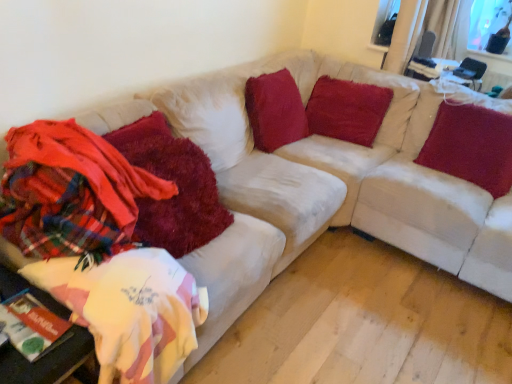
Question: Should I look upward or downward to see shaggy red blanket at left, the 2th blanket from the left?

Choices:
 (A) down
 (B) up

Answer: (A)

Question: Can you confirm if velvet red pillow at upper right, which is counted as the third pillow, starting from the left, is bigger than velvety red pillow at upper center, the second pillow in the right-to-left sequence?

Choices:
 (A) no
 (B) yes

Answer: (B)

Question: Could you tell me if velvet red pillow at upper right, which is the first pillow from right to left, is turned towards velvety red pillow at upper center, the second pillow viewed from the left?

Choices:
 (A) no
 (B) yes

Answer: (A)

Question: From the image's perspective, is velvet red pillow at upper right, which is counted as the third pillow, starting from the left, beneath velvety red pillow at upper center, the second pillow viewed from the left?

Choices:
 (A) yes
 (B) no

Answer: (A)

Question: Does velvet red pillow at upper right, which is counted as the third pillow, starting from the left, have a lesser height compared to velvety red pillow at upper center, the second pillow in the right-to-left sequence?

Choices:
 (A) yes
 (B) no

Answer: (A)

Question: Does velvet red pillow at upper right, which is the first pillow from right to left, have a greater height compared to velvety red pillow at upper center, the second pillow in the right-to-left sequence?

Choices:
 (A) no
 (B) yes

Answer: (A)

Question: From a real-world perspective, is velvet red pillow at upper right, which is counted as the third pillow, starting from the left, over velvety red pillow at upper center, the second pillow viewed from the left?

Choices:
 (A) yes
 (B) no

Answer: (A)

Question: Is velvety red pillow at upper center, the third pillow positioned from the right, further to the viewer compared to transparent glass window at upper right, the first window screen viewed from the right?

Choices:
 (A) no
 (B) yes

Answer: (A)

Question: Considering the relative sizes of velvety red pillow at upper center, the third pillow positioned from the right, and transparent glass window at upper right, the second window screen positioned from the left, in the image provided, is velvety red pillow at upper center, the third pillow positioned from the right, bigger than transparent glass window at upper right, the second window screen positioned from the left,?

Choices:
 (A) yes
 (B) no

Answer: (A)

Question: Can you confirm if velvety red pillow at upper center, arranged as the first pillow when viewed from the left, is smaller than transparent glass window at upper right, the first window screen viewed from the right?

Choices:
 (A) no
 (B) yes

Answer: (A)

Question: Is velvety red pillow at upper center, arranged as the first pillow when viewed from the left, thinner than transparent glass window at upper right, the first window screen viewed from the right?

Choices:
 (A) yes
 (B) no

Answer: (B)

Question: Considering the relative sizes of velvety red pillow at upper center, the third pillow positioned from the right, and transparent glass window at upper right, the first window screen viewed from the right, in the image provided, is velvety red pillow at upper center, the third pillow positioned from the right, shorter than transparent glass window at upper right, the first window screen viewed from the right,?

Choices:
 (A) yes
 (B) no

Answer: (B)

Question: From a real-world perspective, is velvety red pillow at upper center, the third pillow positioned from the right, positioned over transparent glass window at upper right, the first window screen viewed from the right, based on gravity?

Choices:
 (A) yes
 (B) no

Answer: (B)

Question: Does white fabric table at lower left contain shaggy red blanket at left, the 2th blanket from the left?

Choices:
 (A) yes
 (B) no

Answer: (B)